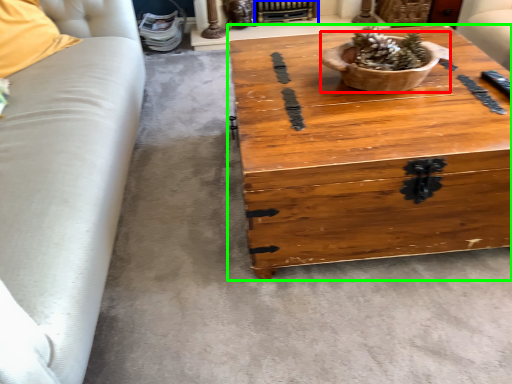
Question: Considering the real-world distances, which object is farthest from flowerpot (highlighted by a red box)? fireplace (highlighted by a blue box) or coffee table (highlighted by a green box)?

Choices:
 (A) fireplace
 (B) coffee table

Answer: (A)